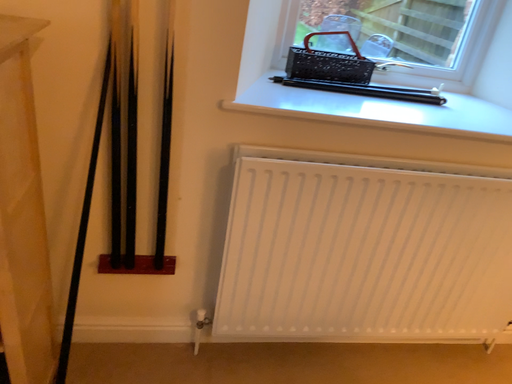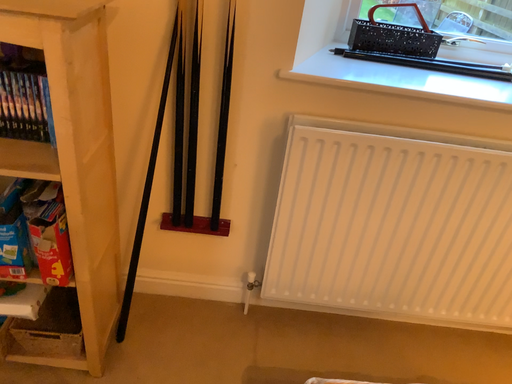
Question: How did the camera likely rotate when shooting the video?

Choices:
 (A) rotated right
 (B) rotated left

Answer: (B)